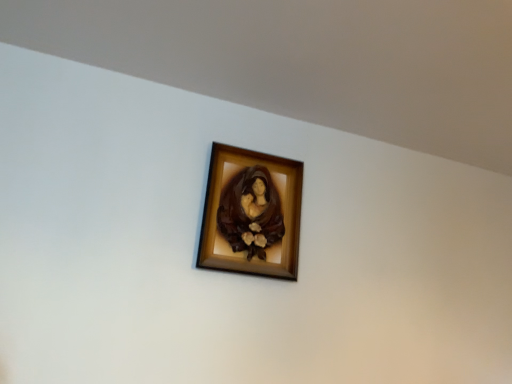
Image resolution: width=512 pixels, height=384 pixels. What do you see at coordinates (251, 213) in the screenshot? I see `wooden frame at upper center` at bounding box center [251, 213].

Where is `wooden frame at upper center`? wooden frame at upper center is located at coordinates (251, 213).

What is the approximate width of wooden frame at upper center?

The width of wooden frame at upper center is 3.25 inches.

I want to click on wooden frame at upper center, so click(251, 213).